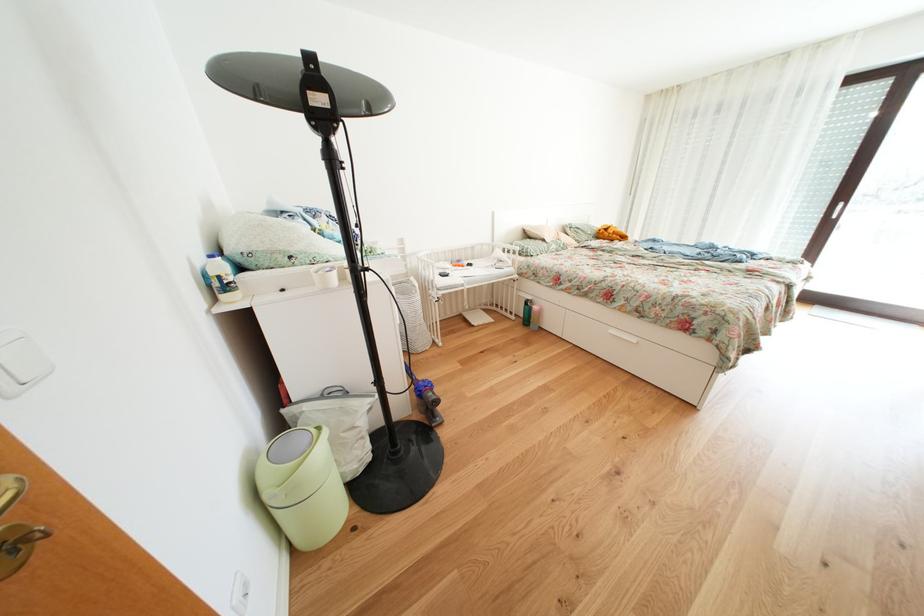
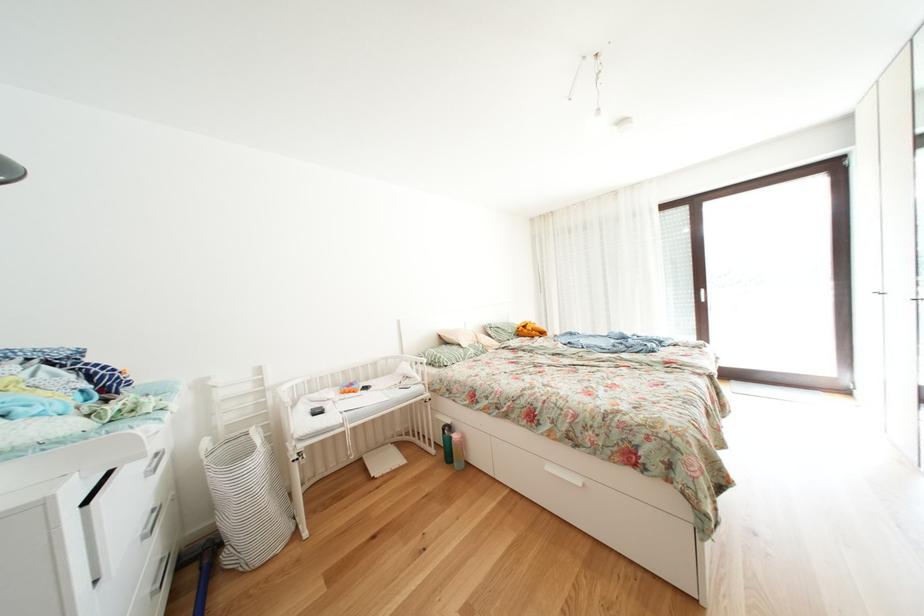
In a continuous first-person perspective shot, in which direction is the camera moving?

The cameraman moved toward right, forward.